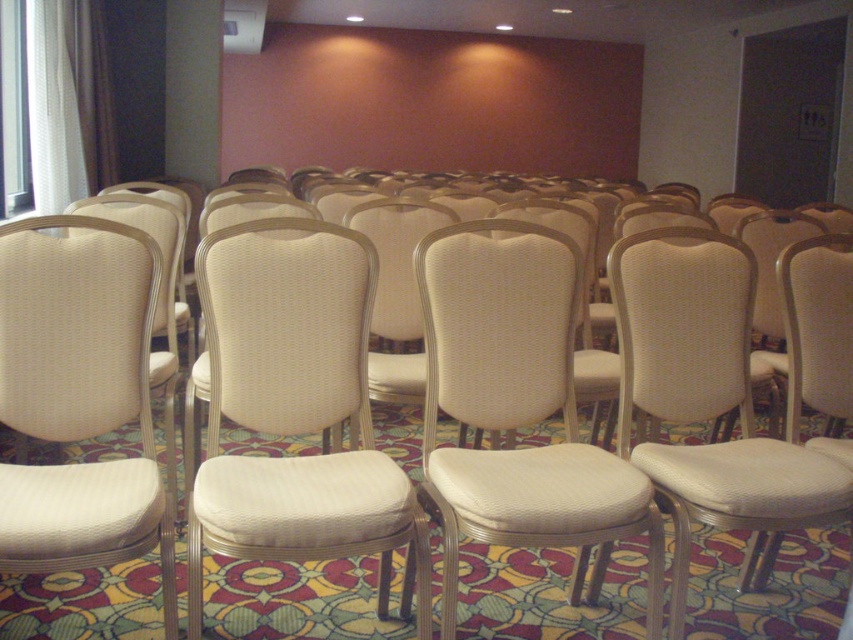
You are standing at the entrance of the room and see the white textured chair at center. If you walk straight towards it, will you encounter any obstacles before reaching the chair?

The white textured chair at center is located at point (517, 406), which is the central area of the room. Since the chairs are arranged in rows facing forward, there are no obstacles directly in front of you as you walk towards the chair. You can proceed straight without any hindrance.

You are standing in the room and want to walk from one point to another. Which point, point (x=51, y=570) or point (x=679, y=625), is closer to you?

Point (x=51, y=570) is closer to the viewer than point (x=679, y=625).